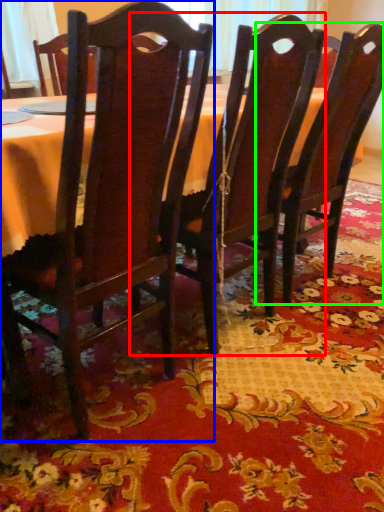
Question: Estimate the real-world distances between objects in this image. Which object is farther from chair (highlighted by a red box), chair (highlighted by a blue box) or chair (highlighted by a green box)?

Choices:
 (A) chair
 (B) chair

Answer: (A)